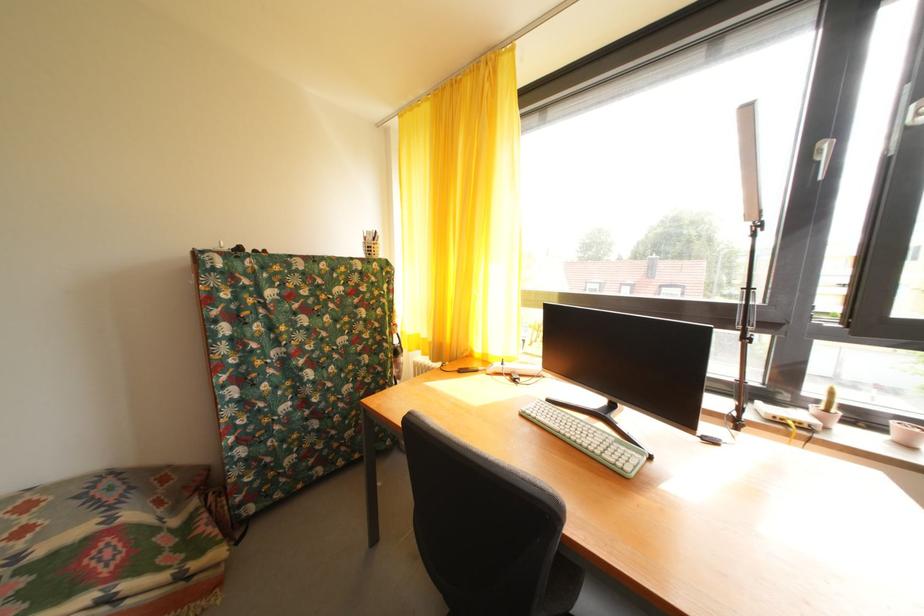
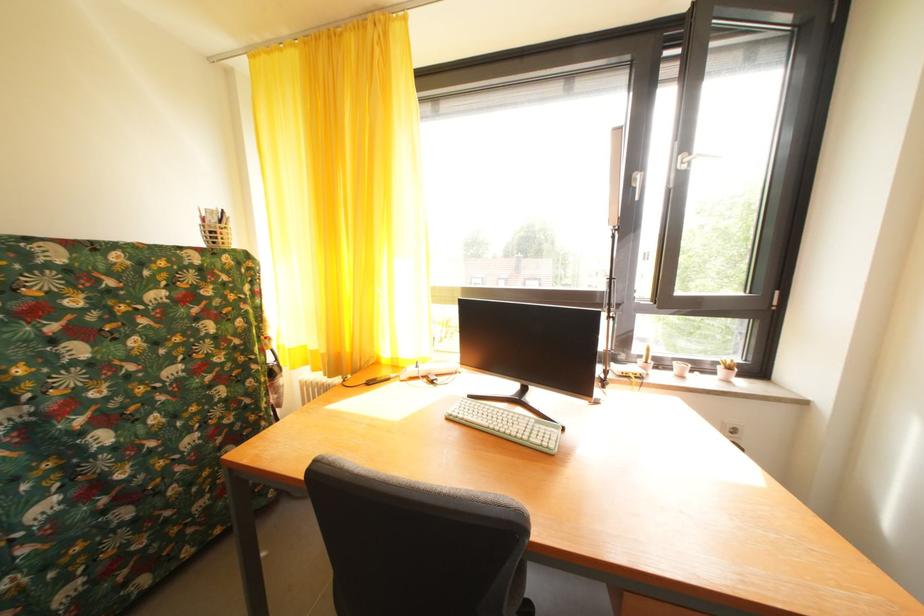
What movement of the cameraman would produce the second image?

The movement direction of the cameraman is left, forward.